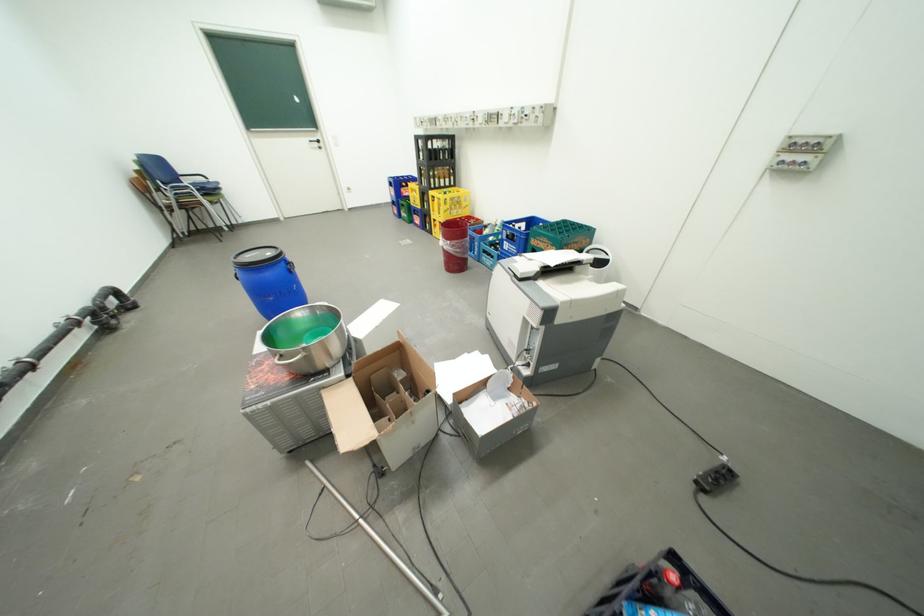
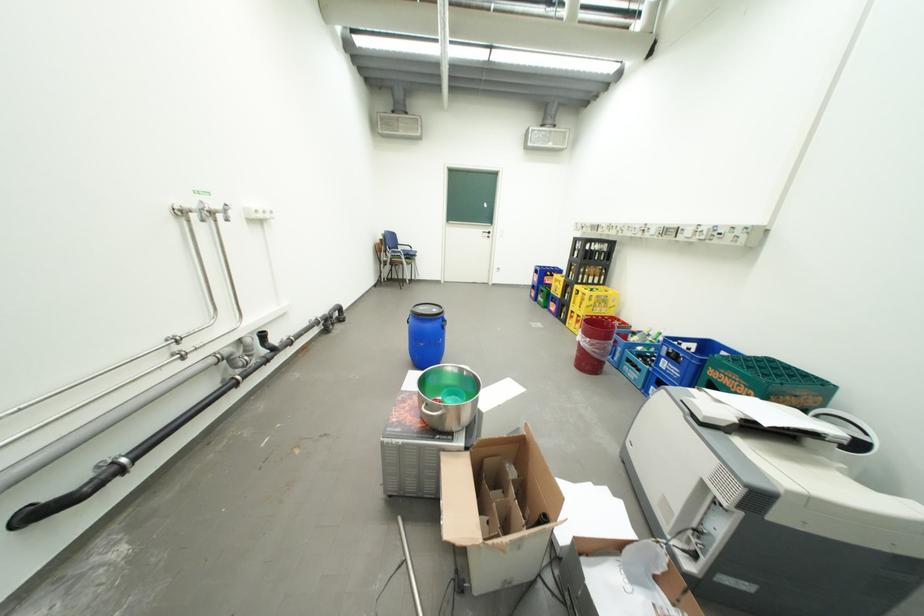
In the second image, find the point that corresponds to point 285,371 in the first image.

(422, 414)